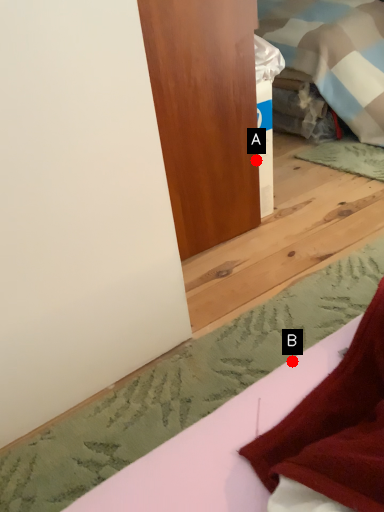
Question: Two points are circled on the image, labeled by A and B beside each circle. Which point appears farthest from the camera in this image?

Choices:
 (A) A is further
 (B) B is further

Answer: (A)